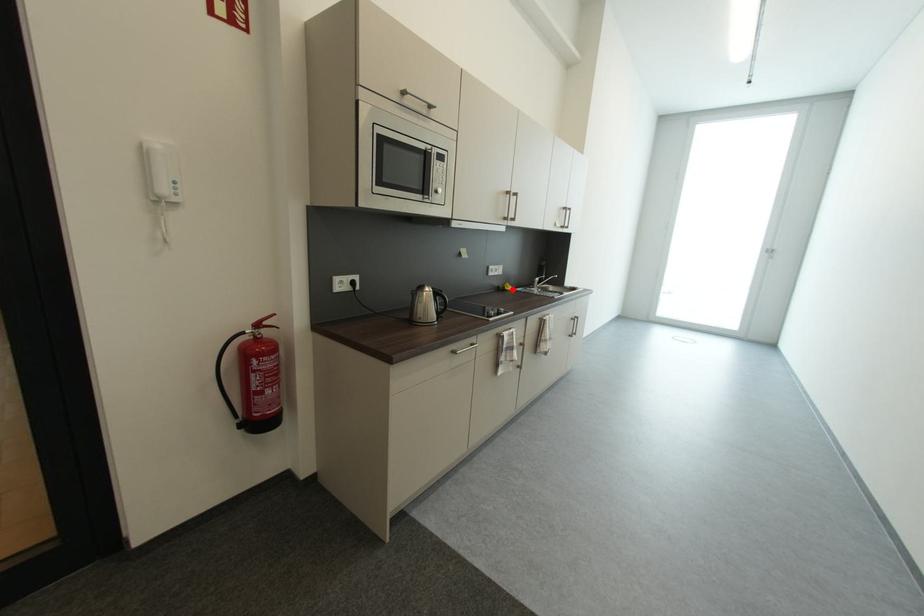
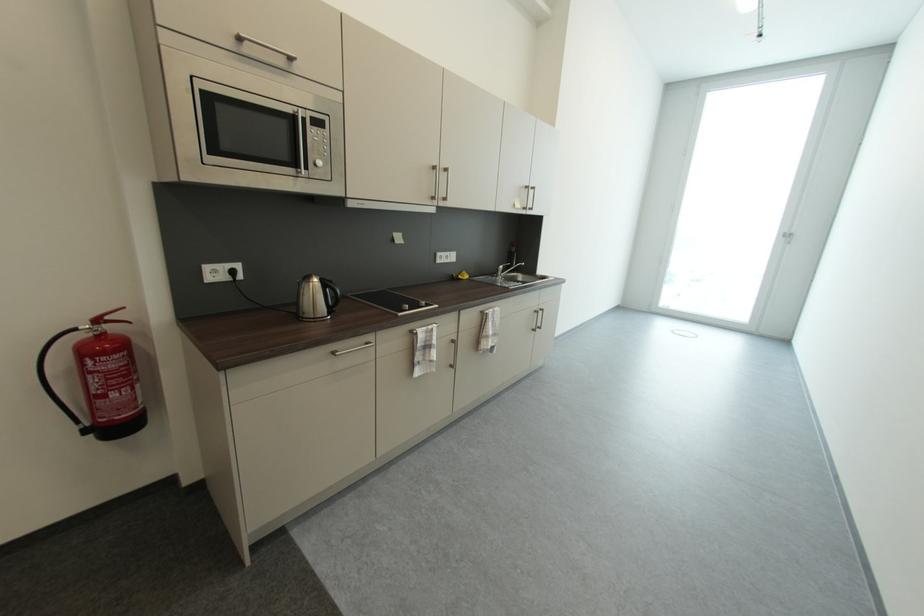
The point at the highlighted location is marked in the first image. Where is the corresponding point in the second image?

(467, 278)